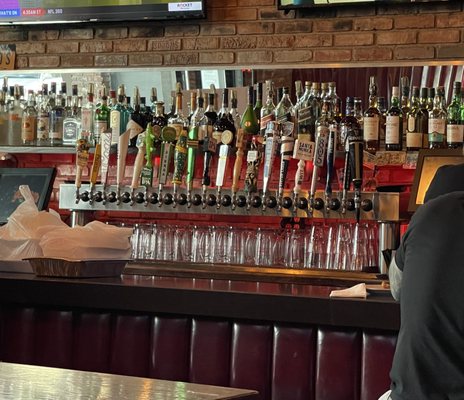
Identify the location of red brick wall. (406, 34).